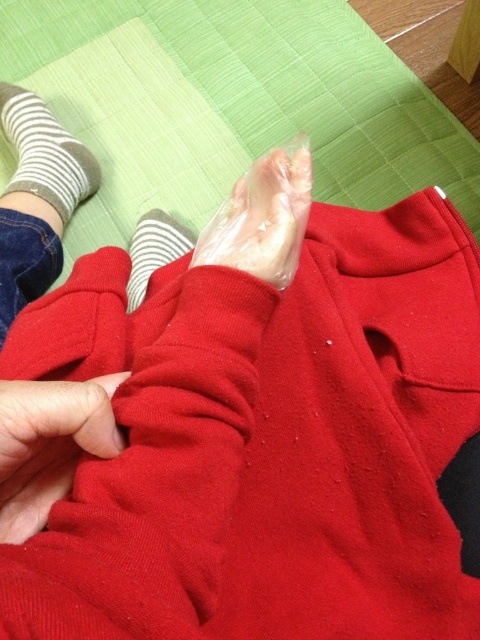
Based on the photo, which is more to the right, transparent plastic foot at center or white striped sock at lower left?

transparent plastic foot at center

The image size is (480, 640). What do you see at coordinates (263, 218) in the screenshot?
I see `transparent plastic foot at center` at bounding box center [263, 218].

Where is `transparent plastic foot at center`? transparent plastic foot at center is located at coordinates (263, 218).

Is transparent plastic foot at center smaller than white striped sock at upper left?

Indeed, transparent plastic foot at center has a smaller size compared to white striped sock at upper left.

Who is higher up, transparent plastic foot at center or white striped sock at upper left?

transparent plastic foot at center

Measure the distance between point (303, 147) and camera.

47.62 centimeters

Where is `transparent plastic foot at center`? This screenshot has width=480, height=640. transparent plastic foot at center is located at coordinates (263, 218).

Can you confirm if white striped sock at lower left is thinner than white striped sock at upper left?

Incorrect, white striped sock at lower left's width is not less than white striped sock at upper left's.

Who is shorter, white striped sock at lower left or white striped sock at upper left?

With less height is white striped sock at upper left.

Which is behind, point (28, 141) or point (157, 209)?

Point (157, 209)

Locate an element on the screen. This screenshot has width=480, height=640. white striped sock at lower left is located at coordinates (46, 154).